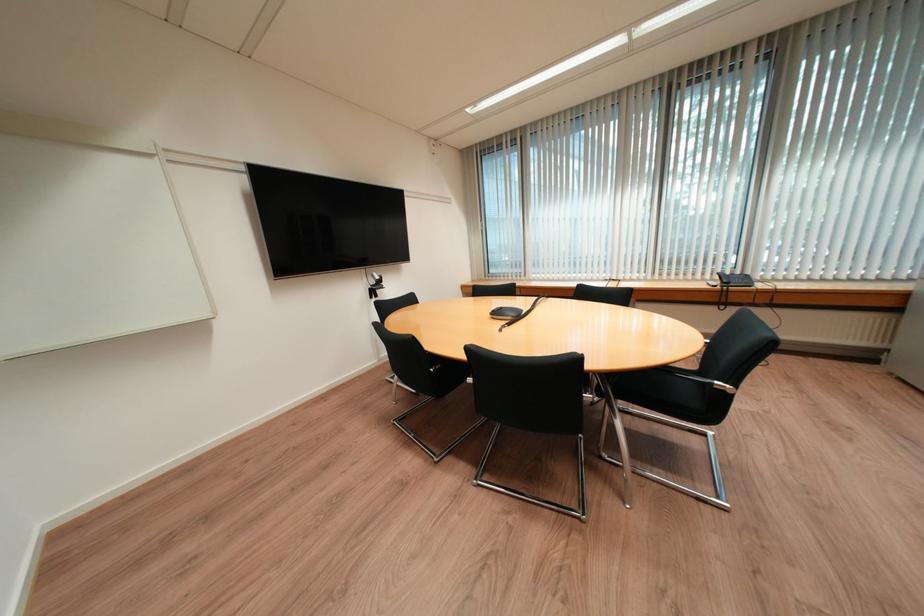
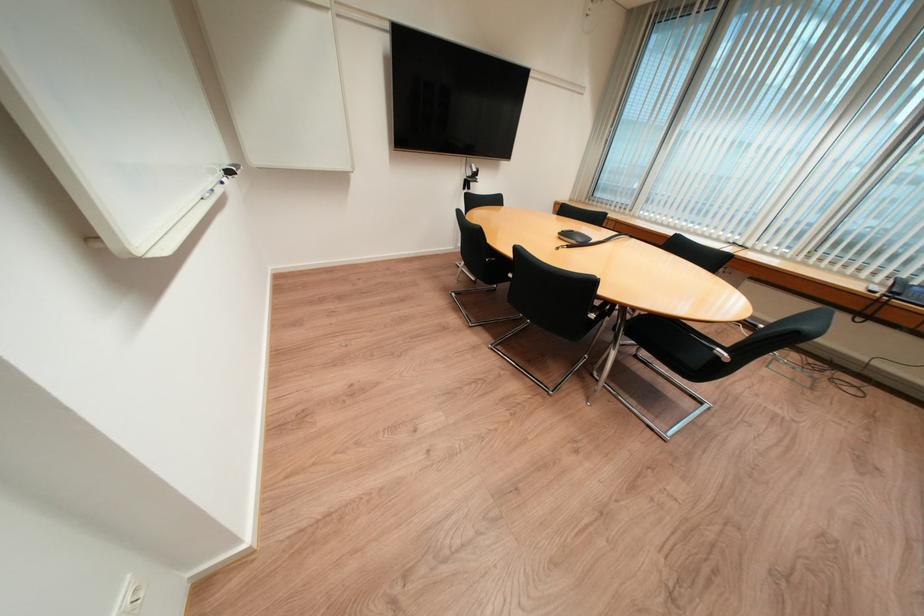
In the second image, find the point that corresponds to pixel 732 392 in the first image.

(725, 359)